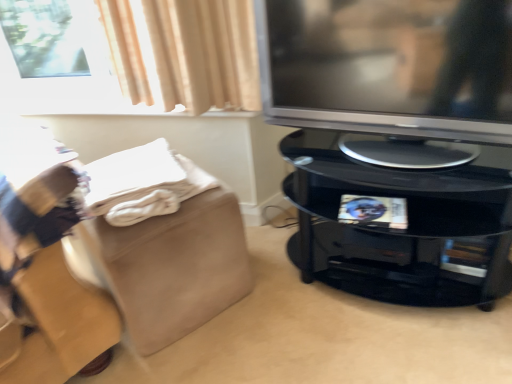
Image resolution: width=512 pixels, height=384 pixels. I want to click on vacant area to the right of beige suede footrest at lower left, so click(x=279, y=298).